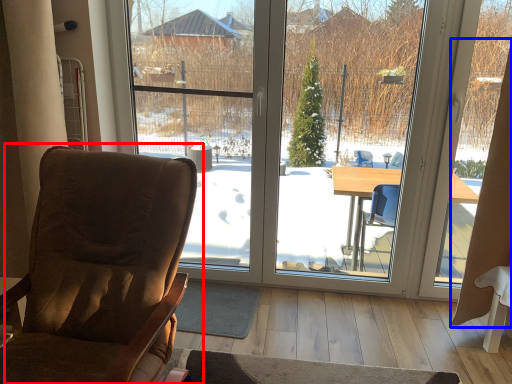
Question: Which object appears closest to the camera in this image, chair (highlighted by a red box) or curtain (highlighted by a blue box)?

Choices:
 (A) chair
 (B) curtain

Answer: (A)